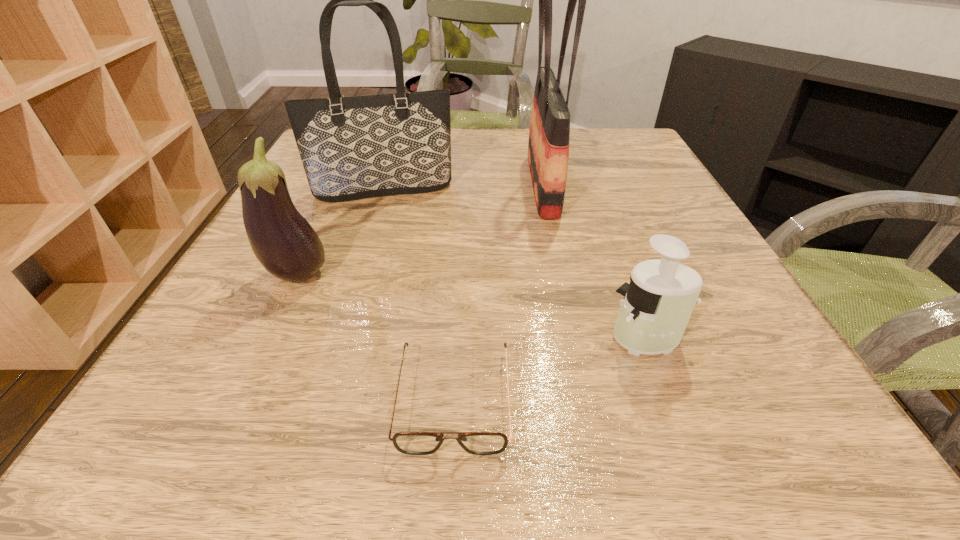
Where is `unoccupied area between the fourth tallest object and the shopping bag`? Image resolution: width=960 pixels, height=540 pixels. unoccupied area between the fourth tallest object and the shopping bag is located at coordinates (594, 262).

Locate an element on the screen. The height and width of the screenshot is (540, 960). vacant space that's between the shortest object and the tote bag is located at coordinates (420, 294).

This screenshot has width=960, height=540. In order to click on free spot between the fourth object from left to right and the third shortest object in this screenshot , I will do `click(420, 230)`.

The image size is (960, 540). Identify the location of the third closest object to the tote bag. click(413, 443).

Select which object appears as the second closest to the juicer. Please provide its 2D coordinates. Your answer should be formatted as a tuple, i.e. [(x, y)], where the tuple contains the x and y coordinates of a point satisfying the conditions above.

[(548, 149)]

Image resolution: width=960 pixels, height=540 pixels. I want to click on vacant space that satisfies the following two spatial constraints: 1. on the front-facing side of the fourth object from left to right; 2. on the front-facing side of the shortest object, so click(x=588, y=398).

The height and width of the screenshot is (540, 960). I want to click on free space that satisfies the following two spatial constraints: 1. on the front side of the eggplant; 2. on the left side of the fourth tallest object, so click(x=269, y=338).

The width and height of the screenshot is (960, 540). Find the location of `vacant space that satisfies the following two spatial constraints: 1. on the front-facing side of the fourth object from left to right; 2. on the front side of the tote bag`. vacant space that satisfies the following two spatial constraints: 1. on the front-facing side of the fourth object from left to right; 2. on the front side of the tote bag is located at coordinates (543, 190).

What are the coordinates of `vacant position in the image that satisfies the following two spatial constraints: 1. on the front side of the tote bag; 2. on the right side of the juicer` in the screenshot? It's located at (336, 338).

Identify the location of vacant space that satisfies the following two spatial constraints: 1. on the front-facing side of the second object from right to left; 2. on the front side of the third farthest object. This screenshot has width=960, height=540. point(562,275).